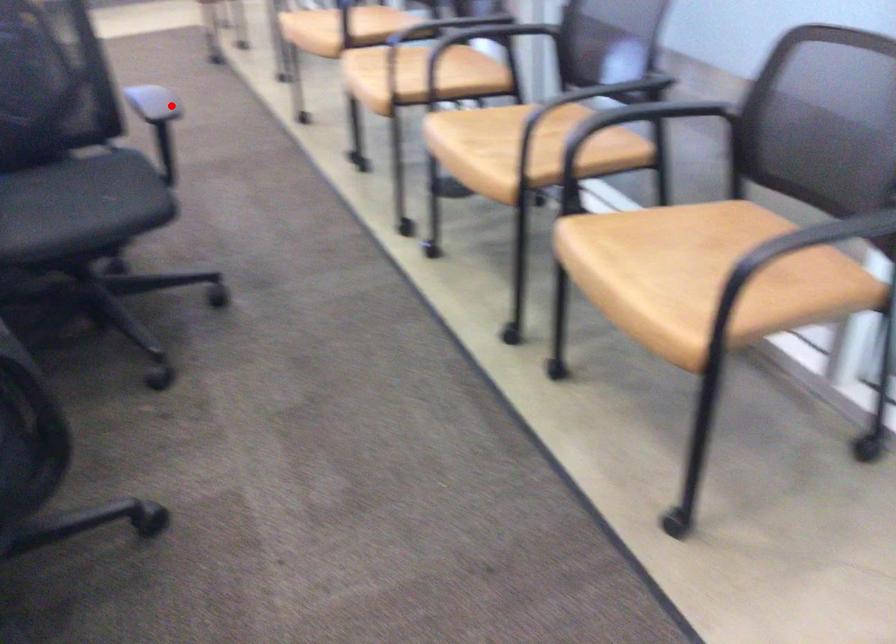
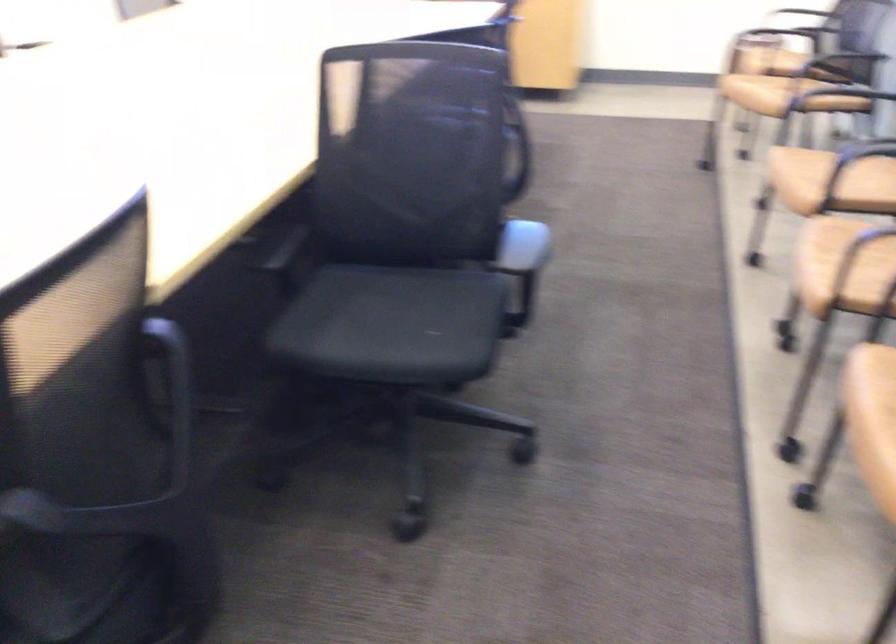
Find the pixel in the second image that matches the highlighted location in the first image.

(523, 250)